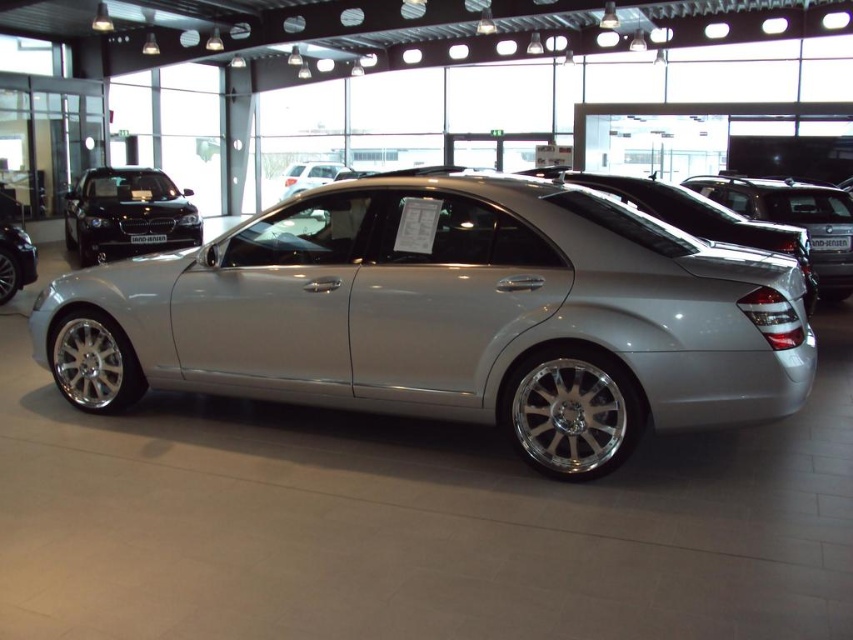
In the scene shown: Who is more distant from viewer, (785, 186) or (30, 268)?

The point (30, 268) is behind.

Which is above, satin silver car at right or silver metallic car at left?

Positioned higher is satin silver car at right.

Is point (735, 188) positioned after point (3, 278)?

No, (735, 188) is closer to viewer.

The height and width of the screenshot is (640, 853). Identify the location of satin silver car at right. (793, 220).

Is shiny black car at left bigger than satin silver car at right?

Yes.

Which of these two, shiny black car at left or satin silver car at right, stands taller?

shiny black car at left

Find the location of a particular element. Image resolution: width=853 pixels, height=640 pixels. shiny black car at left is located at coordinates (126, 212).

Locate an element on the screen. Image resolution: width=853 pixels, height=640 pixels. shiny black car at left is located at coordinates (126, 212).

Can you confirm if shiny black car at left is positioned to the left of silver metallic car at left?

Yes, shiny black car at left is to the left of silver metallic car at left.

Does point (142, 196) come behind point (1, 278)?

Yes, it is.

Between point (82, 196) and point (0, 298), which one is positioned in front?

Positioned in front is point (0, 298).

In order to click on shiny black car at left in this screenshot , I will do `click(126, 212)`.